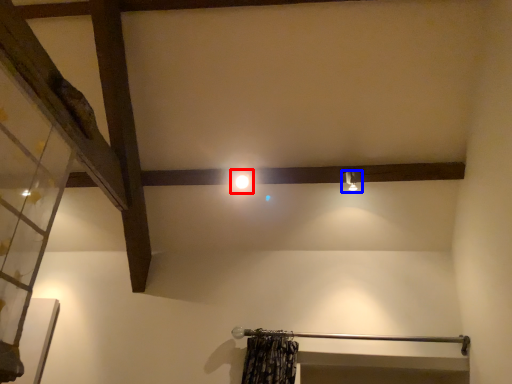
Question: Which object appears farthest to the camera in this image, light (highlighted by a red box) or light fixture (highlighted by a blue box)?

Choices:
 (A) light
 (B) light fixture

Answer: (A)